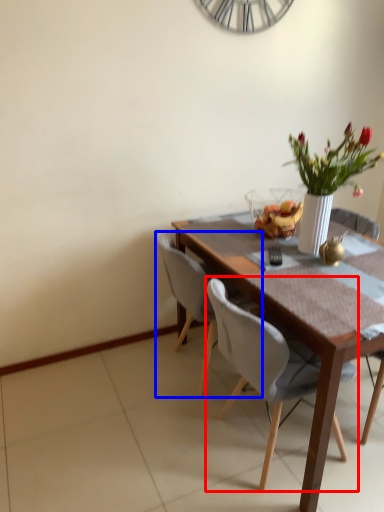
Question: Which point is closer to the camera, chair (highlighted by a red box) or chair (highlighted by a blue box)?

Choices:
 (A) chair
 (B) chair

Answer: (A)